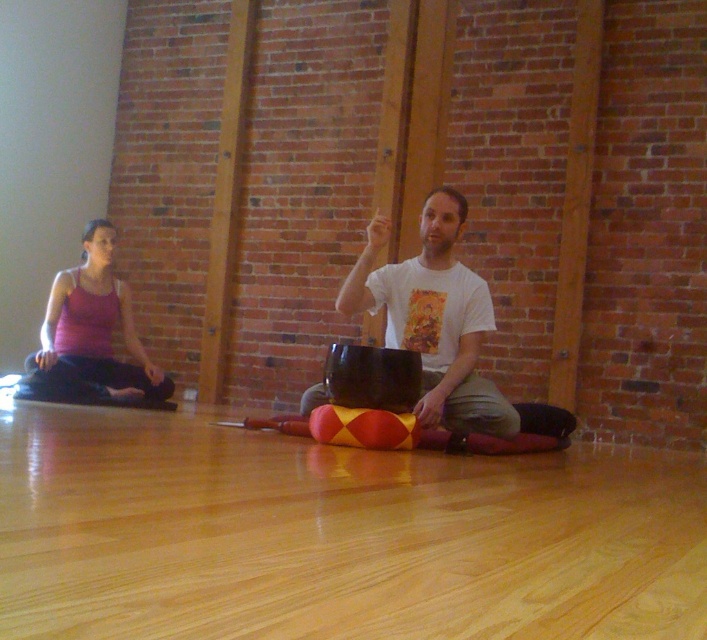
Question: In this image, where is white matte t-shirt at center located relative to matte pink tank top at left?

Choices:
 (A) above
 (B) below

Answer: (B)

Question: Is the position of white matte t-shirt at center more distant than that of matte pink tank top at left?

Choices:
 (A) no
 (B) yes

Answer: (A)

Question: Which point is closer to the camera taking this photo?

Choices:
 (A) pyautogui.click(x=103, y=353)
 (B) pyautogui.click(x=404, y=316)

Answer: (B)

Question: Which of the following is the farthest from the observer?

Choices:
 (A) (111, 355)
 (B) (455, 332)

Answer: (A)

Question: Is white matte t-shirt at center below matte pink tank top at left?

Choices:
 (A) no
 (B) yes

Answer: (B)